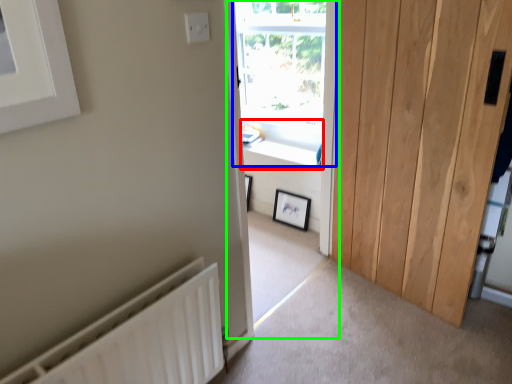
Question: Which object is positioned farthest from window sill (highlighted by a red box)? Select from window (highlighted by a blue box) and window frame (highlighted by a green box).

Choices:
 (A) window
 (B) window frame

Answer: (A)